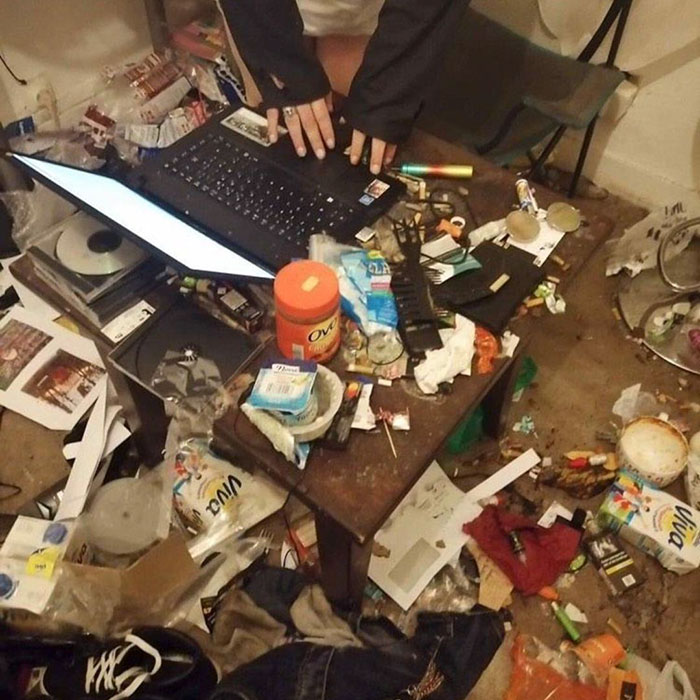
The width and height of the screenshot is (700, 700). Find the location of `table`. table is located at coordinates (404, 470).